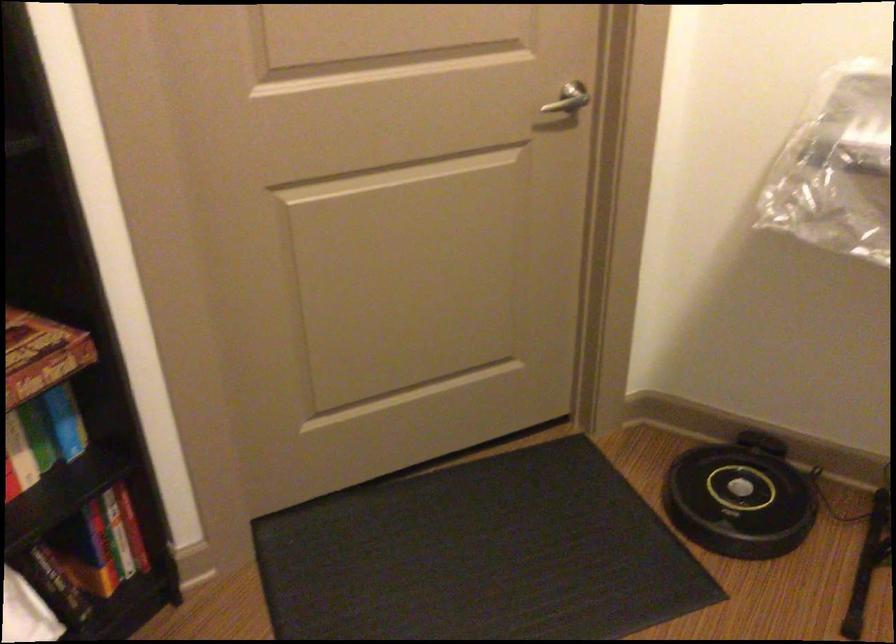
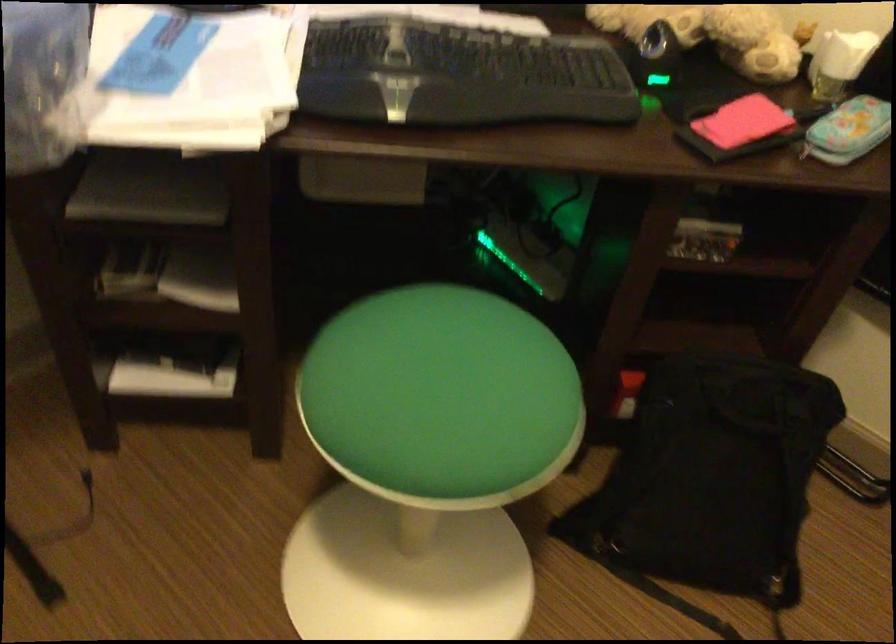
How did the camera likely rotate?

The camera's rotation is toward right-down.